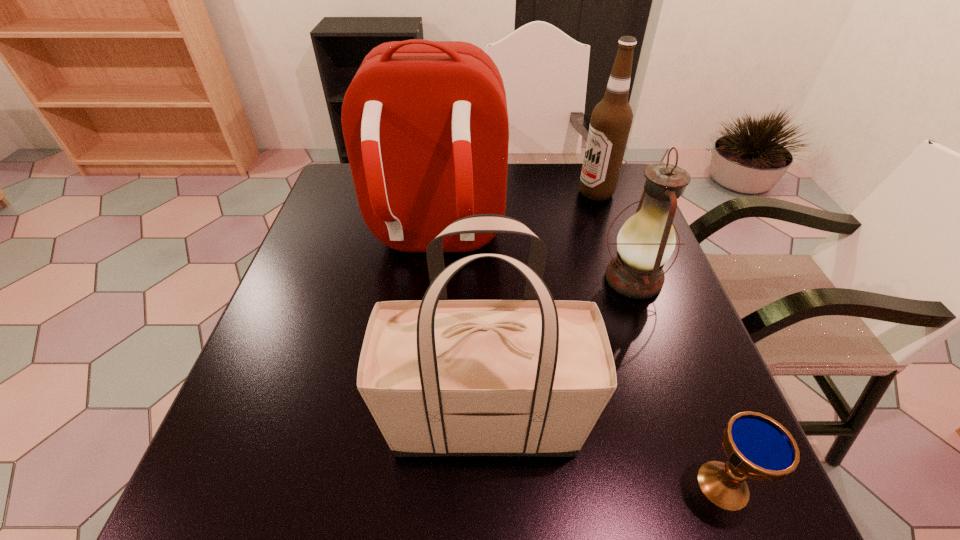
The image size is (960, 540). In order to click on free space that satisfies the following two spatial constraints: 1. on the back side of the chalice; 2. with handles facing forward on the shopping bag in this screenshot , I will do `click(699, 421)`.

Locate an element on the screen. free space that satisfies the following two spatial constraints: 1. on the back side of the chalice; 2. on the label of the alcohol is located at coordinates (612, 193).

Where is `vacant region that satisfies the following two spatial constraints: 1. on the label of the alcohol; 2. on the back side of the fourth tallest object`? vacant region that satisfies the following two spatial constraints: 1. on the label of the alcohol; 2. on the back side of the fourth tallest object is located at coordinates (626, 279).

At what (x,y) coordinates should I click in order to perform the action: click on free space in the image that satisfies the following two spatial constraints: 1. with handles facing forward on the shopping bag; 2. on the back side of the shortest object. Please return your answer as a coordinate pair (x, y). This screenshot has height=540, width=960. Looking at the image, I should click on (486, 485).

Find the location of `free point that satisfies the following two spatial constraints: 1. with handles facing forward on the shopping bag; 2. on the right side of the chalice`. free point that satisfies the following two spatial constraints: 1. with handles facing forward on the shopping bag; 2. on the right side of the chalice is located at coordinates (486, 485).

Identify the location of free location that satisfies the following two spatial constraints: 1. on the label of the alcohol; 2. on the left side of the oil lamp. (626, 279).

This screenshot has width=960, height=540. I want to click on free space that satisfies the following two spatial constraints: 1. on the front side of the shortest object; 2. on the right side of the oil lamp, so click(707, 485).